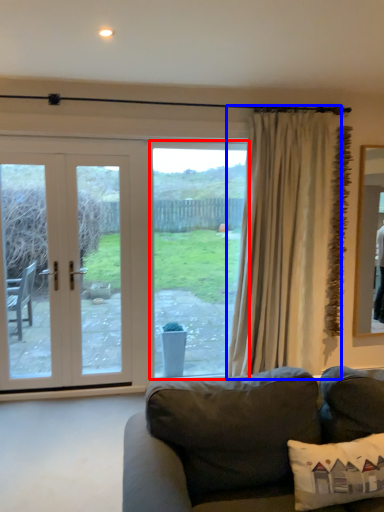
Question: Which object is closer to the camera taking this photo, window (highlighted by a red box) or curtain (highlighted by a blue box)?

Choices:
 (A) window
 (B) curtain

Answer: (B)